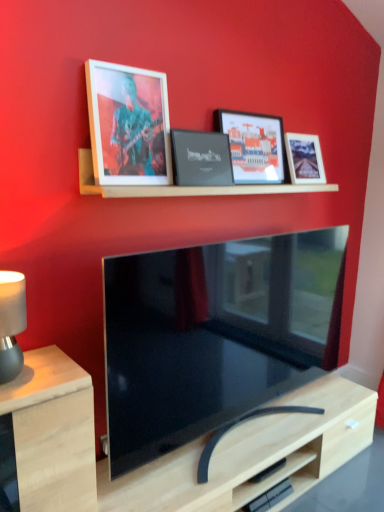
Question: From the image's perspective, is matte wooden picture frame at upper left, positioned as the 4th picture frame in right-to-left order, located above or below black matte picture frame at center, placed as the third picture frame when sorted from right to left?

Choices:
 (A) above
 (B) below

Answer: (A)

Question: Visually, is matte wooden picture frame at upper left, positioned as the 4th picture frame in right-to-left order, positioned to the left or to the right of black matte picture frame at center, placed as the third picture frame when sorted from right to left?

Choices:
 (A) left
 (B) right

Answer: (A)

Question: Estimate the real-world distances between objects in this image. Which object is farther from the matte black tv at center?

Choices:
 (A) matte black picture frame at upper center, positioned as the third picture frame in left-to-right order
 (B) light wood table at lower left
 (C) matte wooden picture frame at upper left, positioned as the 4th picture frame in right-to-left order
 (D) matte white picture frame at upper right, placed as the 4th picture frame when sorted from left to right
 (E) wooden shelf at upper center

Answer: (D)

Question: Which object is the farthest from the wooden shelf at upper center?

Choices:
 (A) matte white picture frame at upper right, placed as the 4th picture frame when sorted from left to right
 (B) matte black lampshade at left
 (C) matte wooden picture frame at upper left, acting as the first picture frame starting from the left
 (D) black matte picture frame at center, which is the 2th picture frame from left to right
 (E) matte black tv at center

Answer: (B)